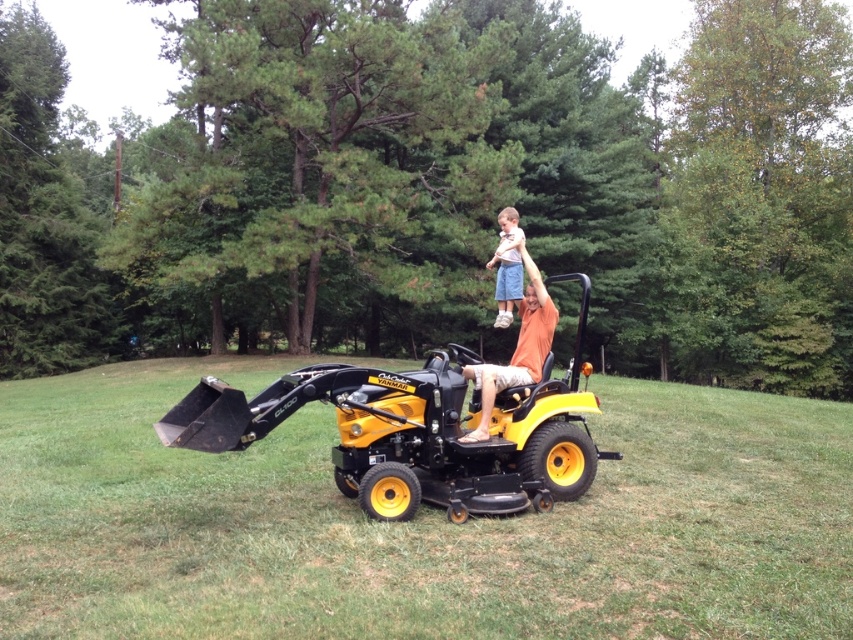
In the scene shown: You are designing a new clothing line and want to compare the thickness of the orange cotton shirt at center and the light blue denim shorts at upper center. Which one is thinner?

The orange cotton shirt at center is thinner than the light blue denim shorts at upper center according to the description.

You are standing at point (503, 266) and want to walk to point (850, 625). Which direction should you move in?

You should move forward because point (850, 625) is in front of point (503, 266).